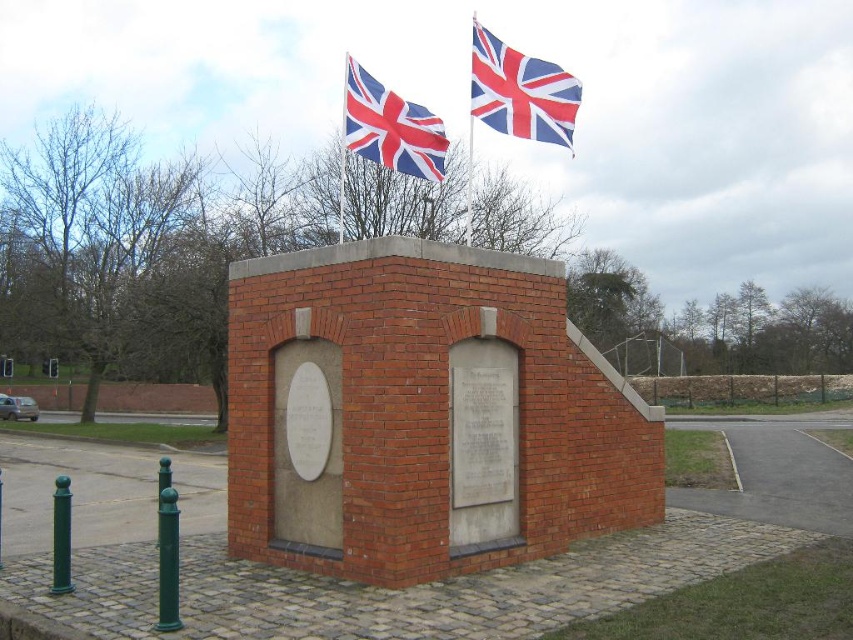
Is matte fabric flag at upper center to the right of red and white fabric flag at upper center from the viewer's perspective?

Yes, matte fabric flag at upper center is to the right of red and white fabric flag at upper center.

Which of these two, matte fabric flag at upper center or red and white fabric flag at upper center, stands taller?

matte fabric flag at upper center is taller.

Identify the location of matte fabric flag at upper center. The image size is (853, 640). (520, 92).

Find the location of a particular element. Image resolution: width=853 pixels, height=640 pixels. matte fabric flag at upper center is located at coordinates (520, 92).